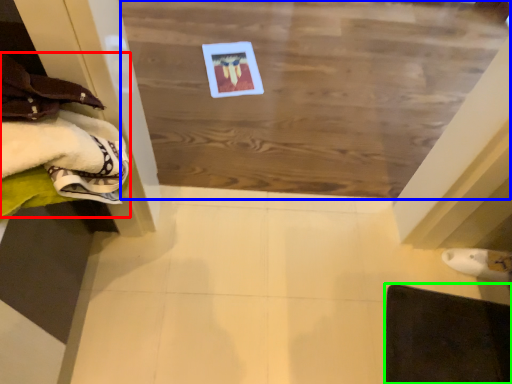
Question: Which is farther away from clothing (highlighted by a red box)? plywood (highlighted by a blue box) or furniture (highlighted by a green box)?

Choices:
 (A) plywood
 (B) furniture

Answer: (B)